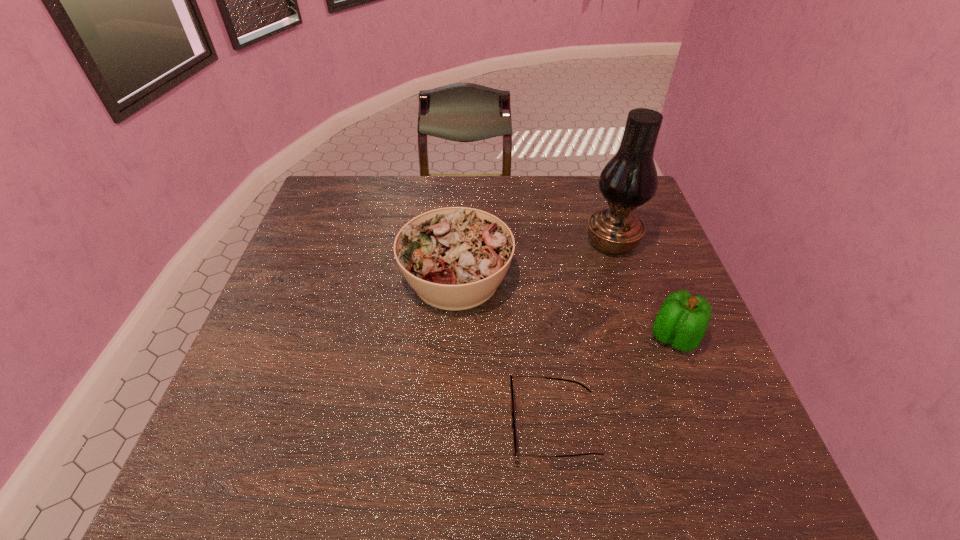
At what (x,y) coordinates should I click in order to perform the action: click on vacant space at the near right corner of the desktop. Please return your answer as a coordinate pair (x, y). Looking at the image, I should click on (734, 455).

I want to click on vacant area that lies between the nearest object and the oil lamp, so click(x=583, y=334).

Locate an element on the screen. This screenshot has width=960, height=540. free spot between the salad and the shortest object is located at coordinates (505, 352).

Image resolution: width=960 pixels, height=540 pixels. I want to click on free space between the bell pepper and the salad, so click(565, 308).

Where is `unoccupied position between the tallest object and the salad`? This screenshot has width=960, height=540. unoccupied position between the tallest object and the salad is located at coordinates (534, 260).

Locate an element on the screen. unoccupied position between the tallest object and the bell pepper is located at coordinates (643, 290).

Identify the location of free space that is in between the salad and the oil lamp. pos(534,260).

The width and height of the screenshot is (960, 540). Find the location of `vacant area between the tallest object and the bell pepper`. vacant area between the tallest object and the bell pepper is located at coordinates (643, 290).

I want to click on free space that is in between the bell pepper and the nearest object, so click(x=613, y=381).

In order to click on free space between the bell pepper and the tallest object in this screenshot , I will do `click(643, 290)`.